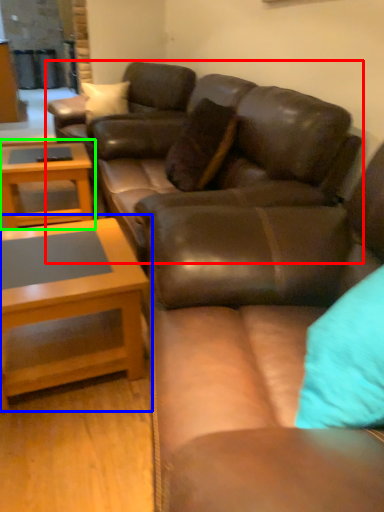
Question: Estimate the real-world distances between objects in this image. Which object is farther from studio couch (highlighted by a red box), coffee table (highlighted by a blue box) or coffee table (highlighted by a green box)?

Choices:
 (A) coffee table
 (B) coffee table

Answer: (B)